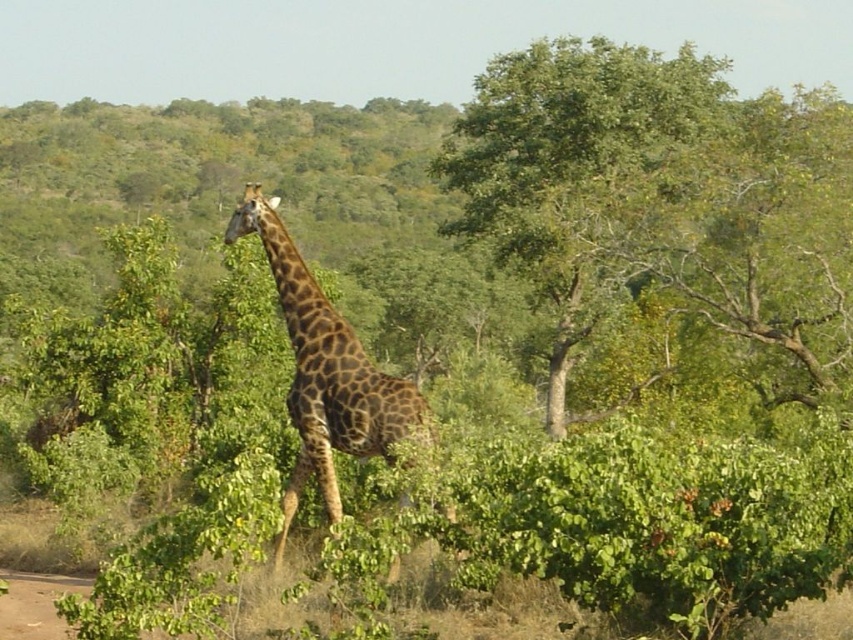
Does green leafy tree at upper right lie in front of spotted fur giraffe at center?

No.

Does green leafy tree at upper right appear under spotted fur giraffe at center?

No, green leafy tree at upper right is not below spotted fur giraffe at center.

Does point (706, 104) come closer to viewer compared to point (329, 445)?

No, it is not.

This screenshot has height=640, width=853. Find the location of `green leafy tree at upper right`. green leafy tree at upper right is located at coordinates (659, 189).